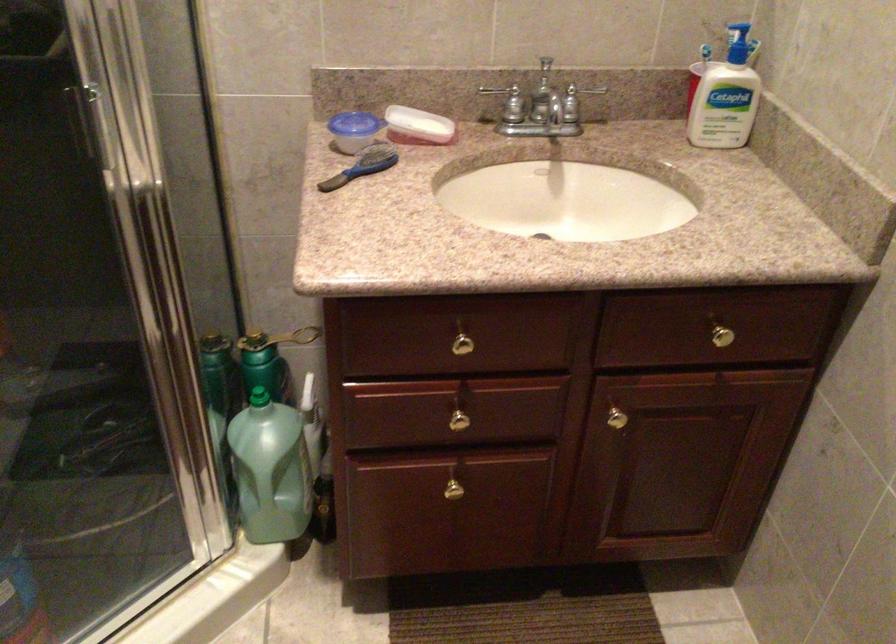
The image size is (896, 644). What do you see at coordinates (574, 105) in the screenshot? I see `the silver shower handle` at bounding box center [574, 105].